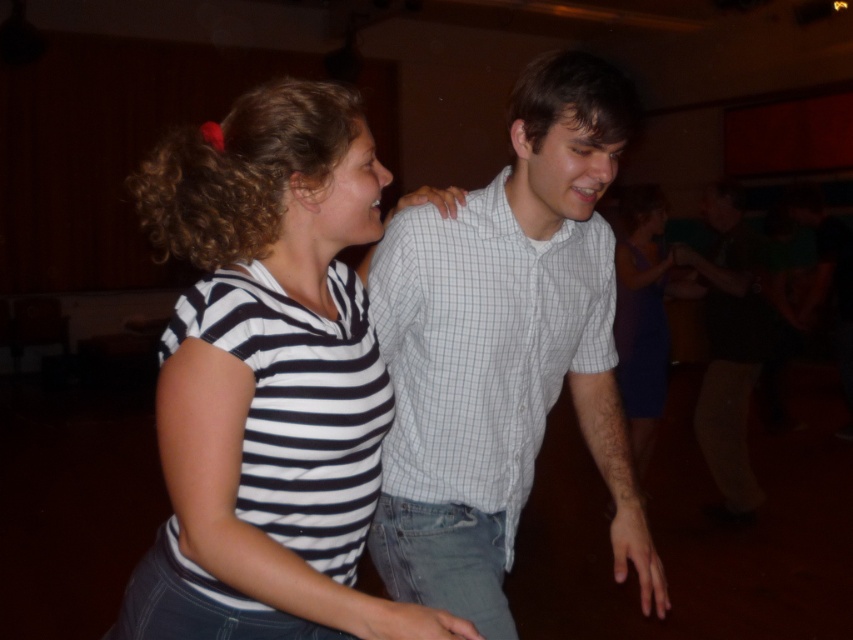
Question: Among these points, which one is farthest from the camera?

Choices:
 (A) (535, 164)
 (B) (648, 365)
 (C) (714, 323)

Answer: (C)

Question: Can you confirm if white checkered shirt at center is positioned to the right of purple satin dress at center?

Choices:
 (A) yes
 (B) no

Answer: (B)

Question: Which of the following is the farthest from the observer?

Choices:
 (A) purple satin dress at center
 (B) striped fabric shirt at center

Answer: (A)

Question: Which of the following is the farthest from the observer?

Choices:
 (A) white checkered shirt at center
 (B) light blue checkered shirt at center

Answer: (B)

Question: In this image, where is striped fabric shirt at center located relative to white checkered shirt at center?

Choices:
 (A) above
 (B) below

Answer: (B)

Question: Does light blue checkered shirt at center appear over purple satin dress at center?

Choices:
 (A) yes
 (B) no

Answer: (B)